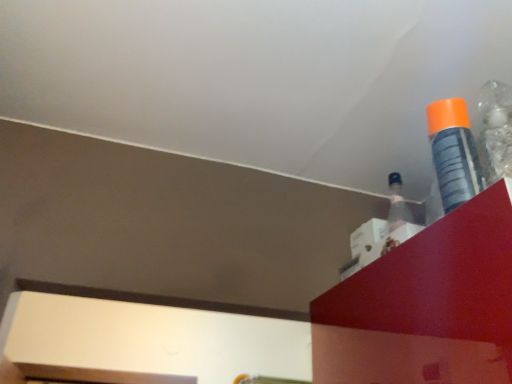
What are the coordinates of `orange matte spray can at upper right` in the screenshot? It's located at (453, 152).

Describe the element at coordinates (453, 152) in the screenshot. This screenshot has width=512, height=384. I see `orange matte spray can at upper right` at that location.

The width and height of the screenshot is (512, 384). Find the location of `orange matte spray can at upper right`. orange matte spray can at upper right is located at coordinates (453, 152).